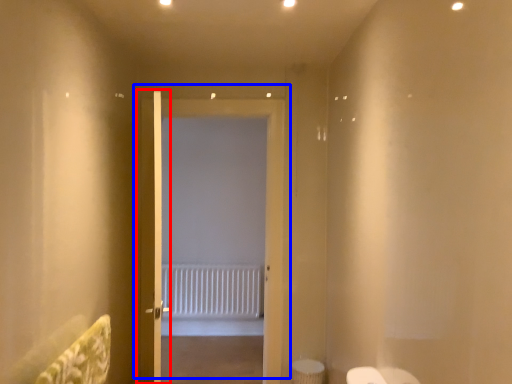
Question: Which of the following is the farthest to the observer, door (highlighted by a red box) or door (highlighted by a blue box)?

Choices:
 (A) door
 (B) door

Answer: (B)